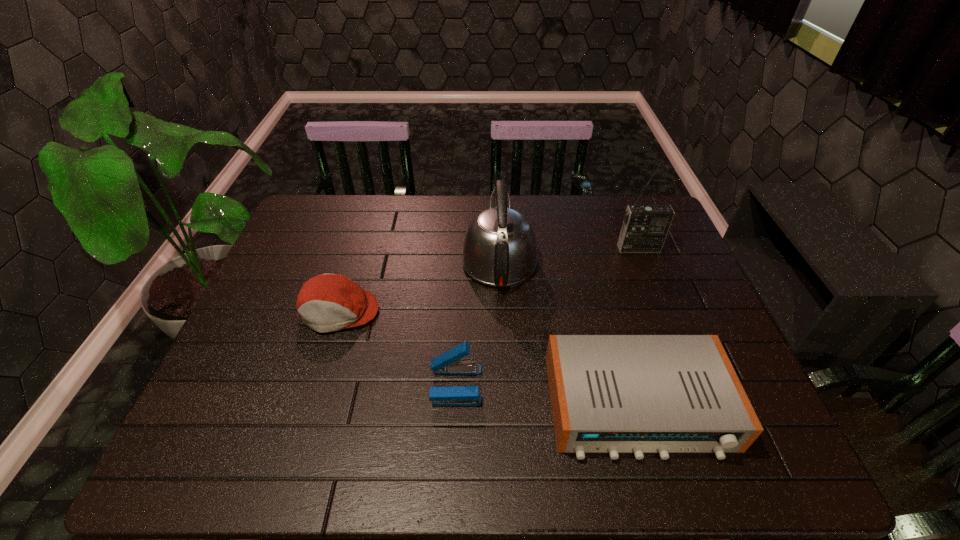
At what (x,y) coordinates should I click in order to perform the action: click on vacant space in between the shorter radio receiver and the leftmost object. Please return your answer as a coordinate pair (x, y). Looking at the image, I should click on (489, 359).

Where is `vacant region between the taller radio receiver and the shorter radio receiver`? The width and height of the screenshot is (960, 540). vacant region between the taller radio receiver and the shorter radio receiver is located at coordinates (638, 327).

Identify the location of vacant point located between the shorter radio receiver and the tallest object. The height and width of the screenshot is (540, 960). (638, 327).

Find the location of a particular element. The height and width of the screenshot is (540, 960). object that is the closest to the nearer radio receiver is located at coordinates (449, 363).

The image size is (960, 540). Find the location of `the closest object relative to the fourth shortest object`. the closest object relative to the fourth shortest object is located at coordinates (613, 394).